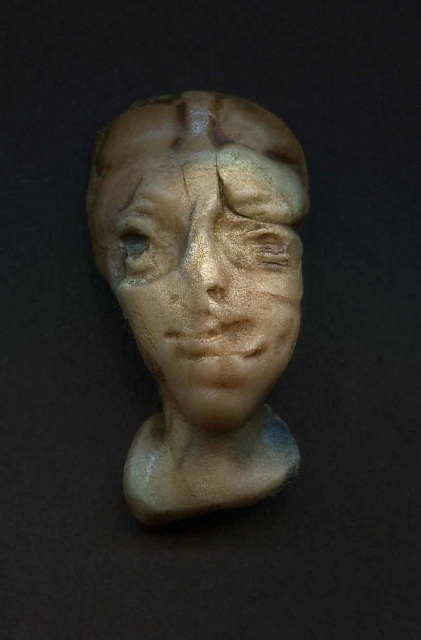
You are an art conservator examining a sculpture. You need to place a protective cover over the matte gold bust at center. The cover must be centered precisely at point (x=205, y=292). Can you confirm the exact location of the matte gold bust at center to ensure proper placement?

The matte gold bust at center is located at point (x=205, y=292), so placing the cover centered at that coordinate will ensure proper coverage.

You are standing 2 meters away from the sculpture. If you move forward 0.72 meters, will you be closer than 1 meter to the point labeled as point (261, 163)?

After moving forward 0.72 meters from your initial position 2 meters away, you will be 1.28 meters away from the point labeled as point (261, 163). Since 1.28 meters is greater than 1 meter, you will not be closer than 1 meter to that point.